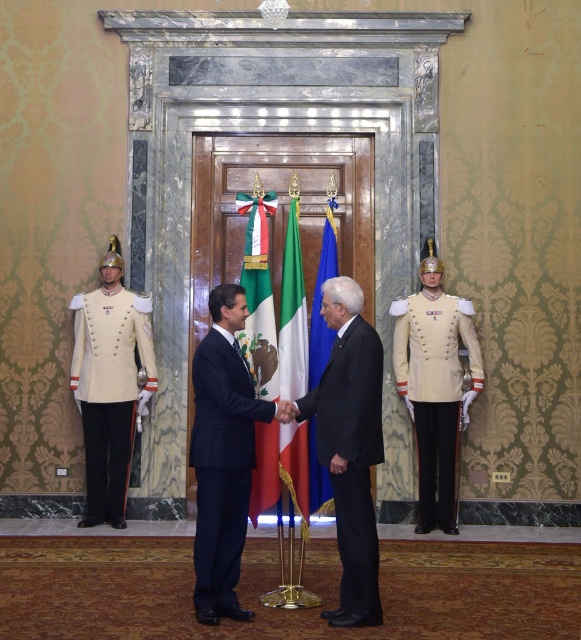
From the picture: You are attending a formal event and need to greet both the navy blue suit at center and the cream matte uniform at left. Which individual should you approach first if you want to follow the standard left to right greeting etiquette?

You should approach the cream matte uniform at left first because the navy blue suit at center is positioned on the right side of cream matte uniform at left, so the cream matte uniform at left is on the left side.

You are attending a formal meeting in an ornate government building and notice a green and white striped flag at center. Where is the flag positioned relative to the marble doorway and the individuals shaking hands?

The green and white striped flag at center is located at point coordinates (259, 292), which places it centrally in the image, likely between the marble doorway and the individuals shaking hands in front of it.

You are attending a formal event and notice two flags displayed in the room. The green fabric flag at center and the blue fabric flag at center. Based on their positioning, which flag is closer to the attendees standing in front of the doorway?

The green fabric flag at center is closer to the attendees standing in front of the doorway because it is positioned in front of the blue fabric flag at center.